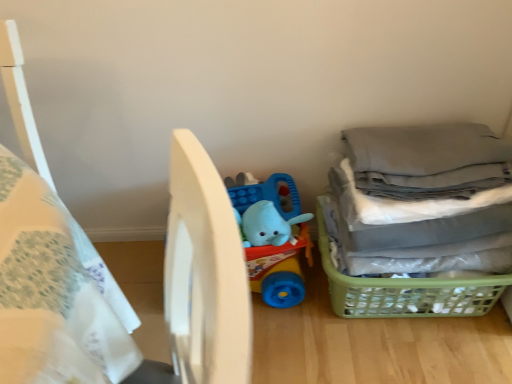
Question: Is gray fabric laundry at right taller or shorter than blue rubber elephant at center?

Choices:
 (A) short
 (B) tall

Answer: (B)

Question: From the image's perspective, is gray fabric laundry at right above or below blue rubber elephant at center?

Choices:
 (A) below
 (B) above

Answer: (B)

Question: Which is farther from the gray fabric laundry at right?

Choices:
 (A) white matte bed at center
 (B) blue rubber elephant at center
 (C) green plastic basket at lower right

Answer: (A)

Question: Which of these objects is positioned closest to the gray fabric laundry at right?

Choices:
 (A) blue rubber elephant at center
 (B) white matte bed at center
 (C) green plastic basket at lower right

Answer: (C)